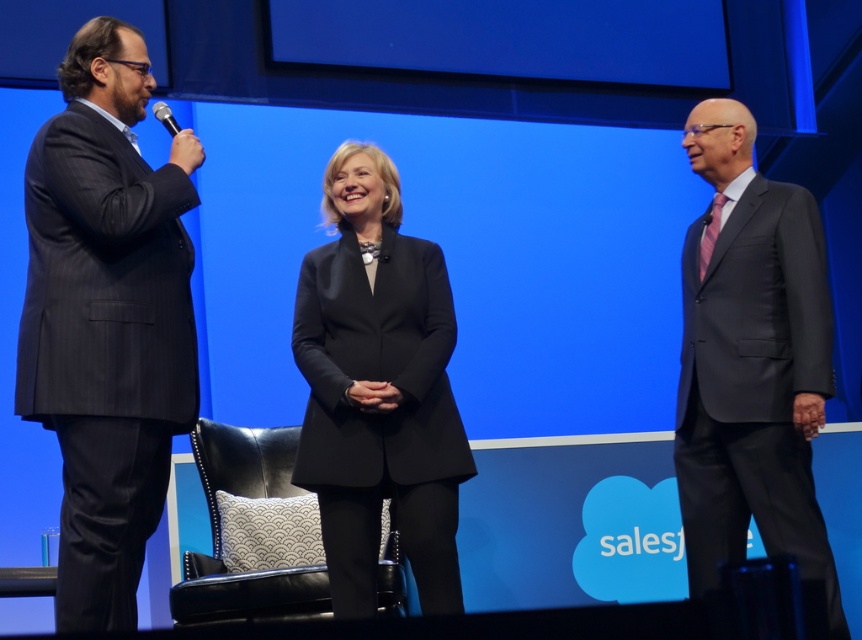
Based on the scene description, what is the 2D coordinate of the dark gray pinstripe suit at left?

The dark gray pinstripe suit at left is located at the 2D coordinate point of (105, 317).

You are standing at the front of the stage and want to move to the point closer to the viewer between point (29, 157) and point (367, 484). Which point should you head towards?

You should head towards point (29, 157) because it is closer to the viewer than point (367, 484).

You are sitting in the black leather chair at center and want to hand a document to the person in the dark gray pinstripe suit at left. Can you reach them without leaving your seat?

The dark gray pinstripe suit at left is above the black leather chair at center, so you can reach them by extending your arm upwards.